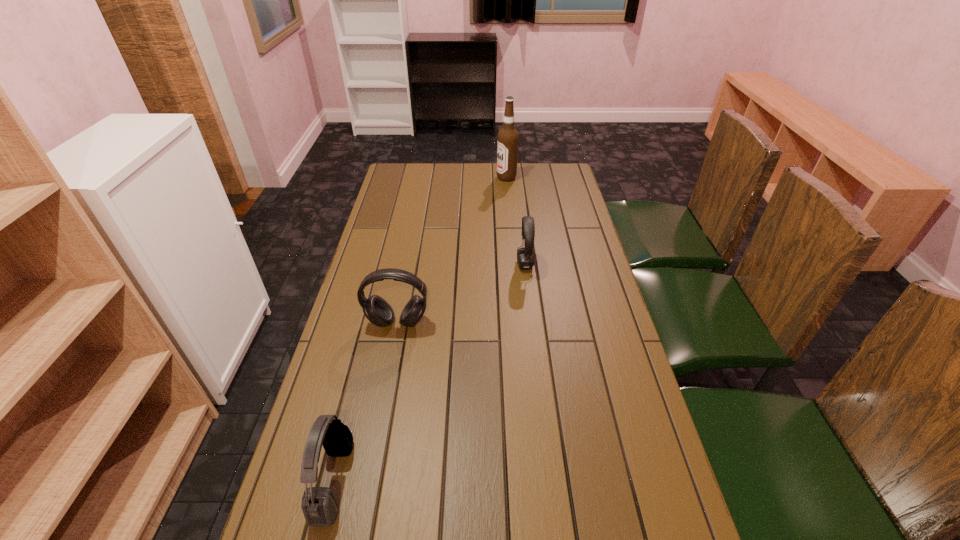
Where is `blank space that satisfies the following two spatial constraints: 1. on the label of the alcohol; 2. on the earcups of the second nearest headset`? The width and height of the screenshot is (960, 540). blank space that satisfies the following two spatial constraints: 1. on the label of the alcohol; 2. on the earcups of the second nearest headset is located at coordinates [x=519, y=323].

The width and height of the screenshot is (960, 540). Identify the location of free space that satisfies the following two spatial constraints: 1. on the front-facing side of the farthest headset; 2. on the earcups of the second farthest headset. (532, 323).